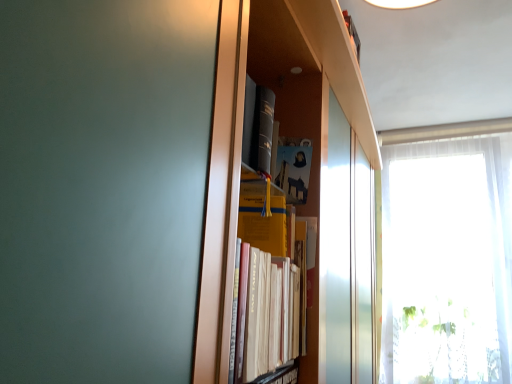
Question: Does point pyautogui.click(x=401, y=183) appear closer or farther from the camera than point pyautogui.click(x=242, y=238)?

Choices:
 (A) closer
 (B) farther

Answer: (B)

Question: Based on their sizes in the image, would you say white sheer curtain at right is bigger or smaller than yellow paper at center, acting as the 2th paperback book starting from the top?

Choices:
 (A) small
 (B) big

Answer: (B)

Question: Which of these objects is positioned farthest from the yellow matte paper at center, the 1th paperback book positioned from the top?

Choices:
 (A) white sheer curtain at right
 (B) yellow paper at center, acting as the 2th paperback book starting from the top

Answer: (A)

Question: Estimate the real-world distances between objects in this image. Which object is closer to the yellow matte paper at center, the 1th paperback book positioned from the top?

Choices:
 (A) white sheer curtain at right
 (B) yellow paper at center, acting as the 2th paperback book starting from the top

Answer: (B)